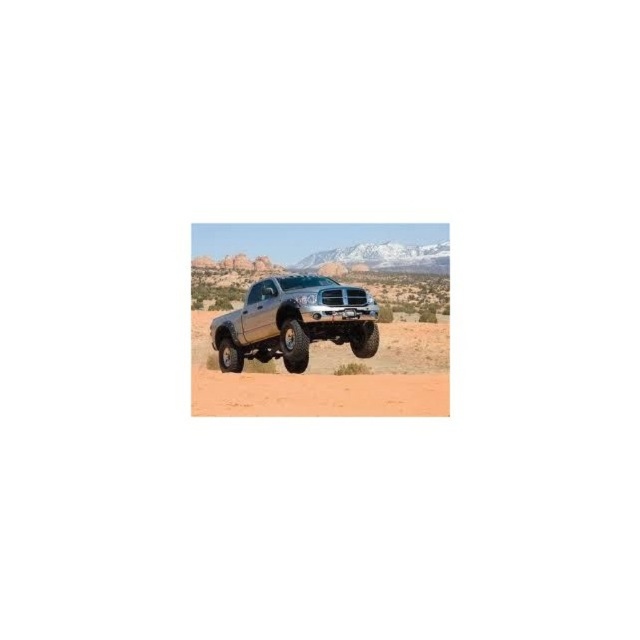
Is sandy brown dirt at center to the right of silver metallic truck at center from the viewer's perspective?

A: Yes, sandy brown dirt at center is to the right of silver metallic truck at center.

Does sandy brown dirt at center lie behind silver metallic truck at center?

No, sandy brown dirt at center is closer to the viewer.

Image resolution: width=640 pixels, height=640 pixels. I want to click on sandy brown dirt at center, so click(x=330, y=378).